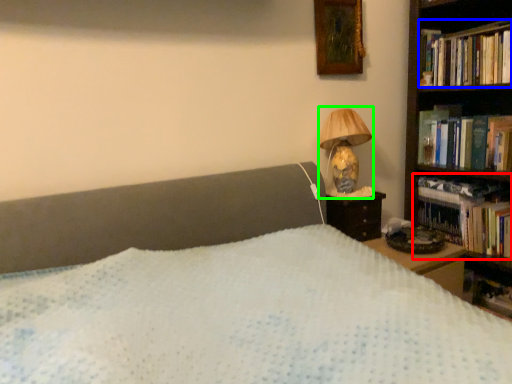
Question: Considering the real-world distances, which object is closest to book (highlighted by a red box)? book (highlighted by a blue box) or lamp (highlighted by a green box).

Choices:
 (A) book
 (B) lamp

Answer: (B)